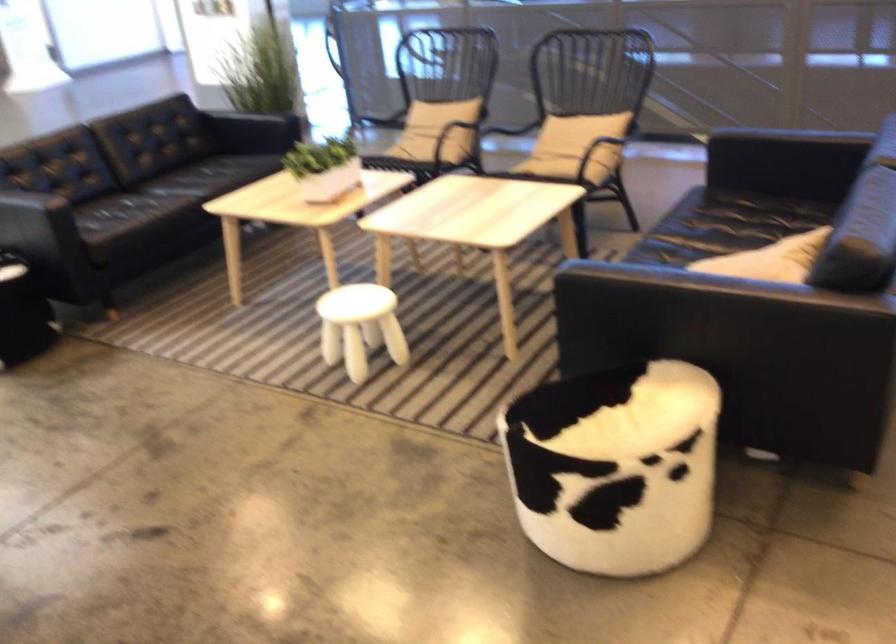
Question: The images are taken continuously from a first-person perspective. In which direction is your viewpoint rotating?

Choices:
 (A) Left
 (B) Right
 (C) Up
 (D) Down

Answer: (B)